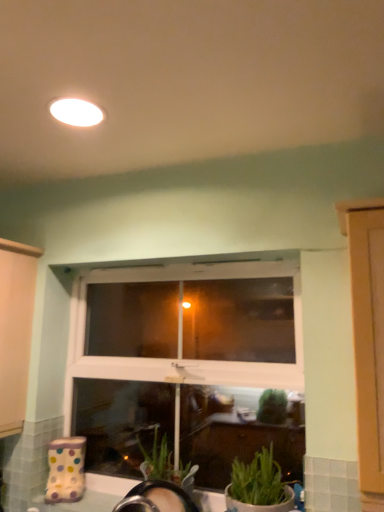
Question: Can you confirm if white matte light fixture at upper center is bigger than white plastic window at center?

Choices:
 (A) no
 (B) yes

Answer: (A)

Question: Is white matte light fixture at upper center wider than white plastic window at center?

Choices:
 (A) yes
 (B) no

Answer: (A)

Question: Could you tell me if white matte light fixture at upper center is turned towards white plastic window at center?

Choices:
 (A) yes
 (B) no

Answer: (B)

Question: From a real-world perspective, is white matte light fixture at upper center on white plastic window at center?

Choices:
 (A) no
 (B) yes

Answer: (B)

Question: Considering the relative sizes of white matte light fixture at upper center and white plastic window at center in the image provided, is white matte light fixture at upper center smaller than white plastic window at center?

Choices:
 (A) yes
 (B) no

Answer: (A)

Question: Can you confirm if white matte light fixture at upper center is positioned to the left of white plastic window at center?

Choices:
 (A) yes
 (B) no

Answer: (A)

Question: Considering the relative sizes of white matte light fixture at upper center and green matte plant at lower right in the image provided, is white matte light fixture at upper center smaller than green matte plant at lower right?

Choices:
 (A) no
 (B) yes

Answer: (B)

Question: Does white matte light fixture at upper center appear on the left side of green matte plant at lower right?

Choices:
 (A) no
 (B) yes

Answer: (B)

Question: From the image's perspective, is white matte light fixture at upper center above green matte plant at lower right?

Choices:
 (A) yes
 (B) no

Answer: (A)

Question: Could green matte plant at lower right be considered to be inside white matte light fixture at upper center?

Choices:
 (A) yes
 (B) no

Answer: (B)

Question: Is white matte light fixture at upper center behind green matte plant at lower right?

Choices:
 (A) yes
 (B) no

Answer: (B)

Question: Considering the relative sizes of white matte light fixture at upper center and green matte plant at lower right in the image provided, is white matte light fixture at upper center shorter than green matte plant at lower right?

Choices:
 (A) yes
 (B) no

Answer: (A)

Question: Is green matte plant at lower right positioned with its back to white matte light fixture at upper center?

Choices:
 (A) no
 (B) yes

Answer: (A)